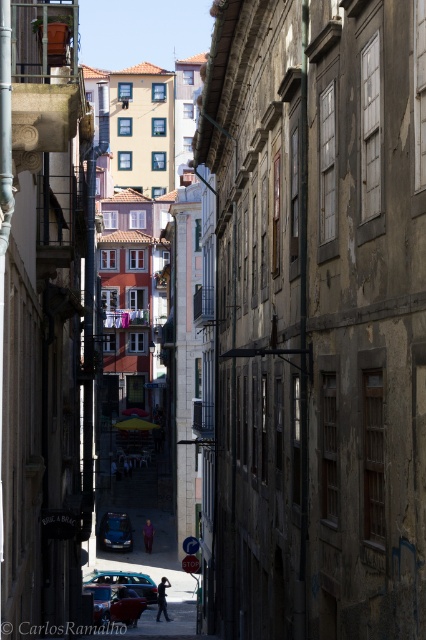
Which is in front, point (98, 572) or point (117, 541)?

Positioned in front is point (98, 572).

Who is positioned more to the left, metallic silver car at center or metallic blue car at center?

Positioned to the left is metallic blue car at center.

Describe the element at coordinates (126, 580) in the screenshot. Image resolution: width=426 pixels, height=640 pixels. I see `metallic silver car at center` at that location.

You are a GUI agent. You are given a task and a screenshot of the screen. Output one action in this format:
    pyautogui.click(x=<x>, y=<y>)
    Task: Click on the metallic silver car at center
    
    Given the screenshot: What is the action you would take?
    pyautogui.click(x=126, y=580)

What do you see at coordinates (141, 540) in the screenshot?
I see `metallic car at center` at bounding box center [141, 540].

Is metallic car at center to the right of metallic silver car at center from the viewer's perspective?

No, metallic car at center is not to the right of metallic silver car at center.

Does point (109, 579) come behind point (86, 573)?

No, (109, 579) is closer to viewer.

Identify the location of metallic car at center. The width and height of the screenshot is (426, 640). (141, 540).

Who is positioned more to the left, rustic stone building at center or metallic car at center?

metallic car at center is more to the left.

Can you confirm if rustic stone building at center is taller than metallic car at center?

Correct, rustic stone building at center is much taller as metallic car at center.

Looking at this image, who is more distant from viewer, (359, 499) or (161, 520)?

Point (161, 520)

Where is `rustic stone building at center`? Image resolution: width=426 pixels, height=640 pixels. rustic stone building at center is located at coordinates (317, 317).